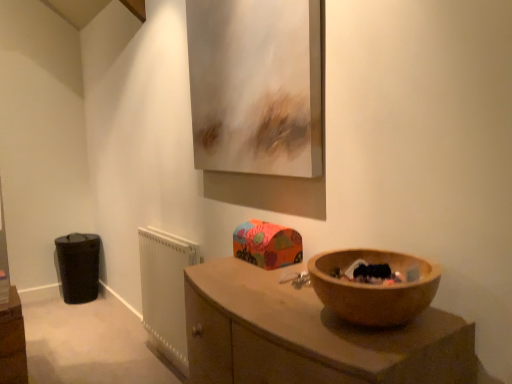
Question: Does black fabric bag at lower left come behind wooden at lower right?

Choices:
 (A) no
 (B) yes

Answer: (B)

Question: From the image's perspective, is black fabric bag at lower left under wooden at lower right?

Choices:
 (A) no
 (B) yes

Answer: (B)

Question: Could wooden at lower right be considered to be inside black fabric bag at lower left?

Choices:
 (A) yes
 (B) no

Answer: (B)

Question: From a real-world perspective, is black fabric bag at lower left below wooden at lower right?

Choices:
 (A) no
 (B) yes

Answer: (B)

Question: Is black fabric bag at lower left looking in the opposite direction of wooden at lower right?

Choices:
 (A) yes
 (B) no

Answer: (B)

Question: From the image's perspective, would you say black fabric bag at lower left is positioned over wooden at lower right?

Choices:
 (A) no
 (B) yes

Answer: (A)

Question: Is metallic silver picture frame at upper center facing away from black fabric bag at lower left?

Choices:
 (A) yes
 (B) no

Answer: (B)

Question: From the image's perspective, is metallic silver picture frame at upper center over black fabric bag at lower left?

Choices:
 (A) no
 (B) yes

Answer: (B)

Question: Can you confirm if metallic silver picture frame at upper center is wider than black fabric bag at lower left?

Choices:
 (A) no
 (B) yes

Answer: (A)

Question: From the image's perspective, is metallic silver picture frame at upper center under black fabric bag at lower left?

Choices:
 (A) yes
 (B) no

Answer: (B)

Question: Is metallic silver picture frame at upper center located outside black fabric bag at lower left?

Choices:
 (A) yes
 (B) no

Answer: (A)

Question: Is metallic silver picture frame at upper center behind black fabric bag at lower left?

Choices:
 (A) yes
 (B) no

Answer: (B)

Question: Considering the relative sizes of white plastic radiator at lower left and wooden at lower right in the image provided, is white plastic radiator at lower left thinner than wooden at lower right?

Choices:
 (A) no
 (B) yes

Answer: (B)